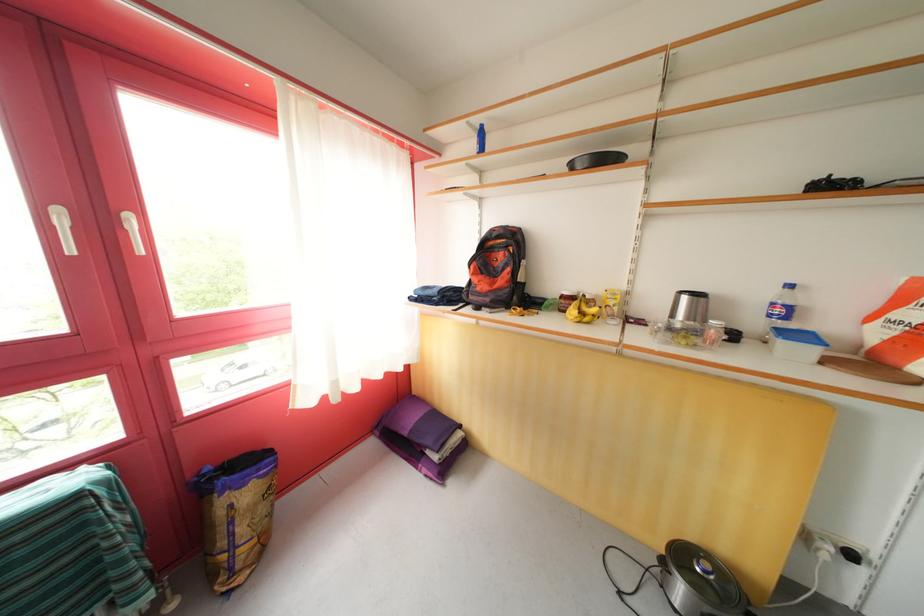
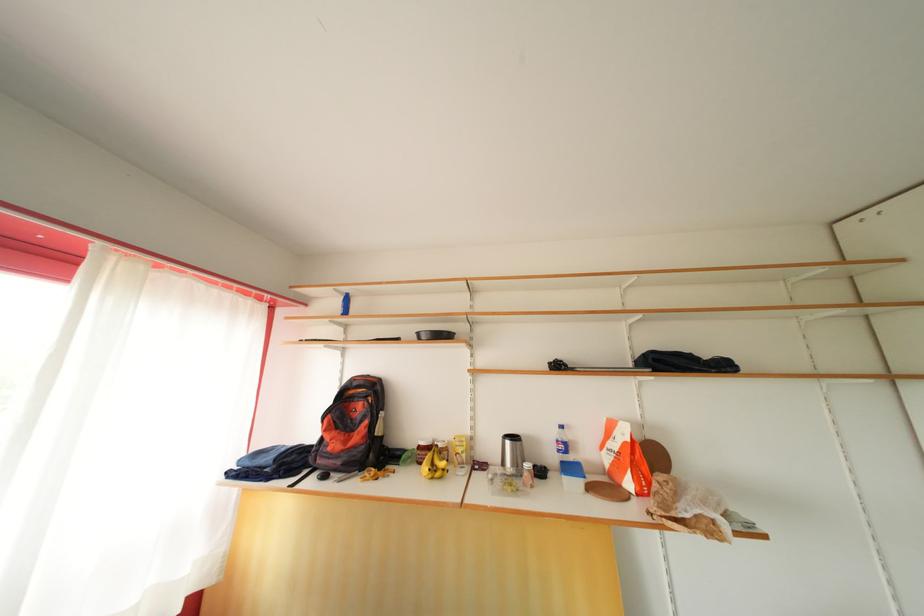
The point at (786, 317) is marked in the first image. Where is the corresponding point in the second image?

(568, 453)